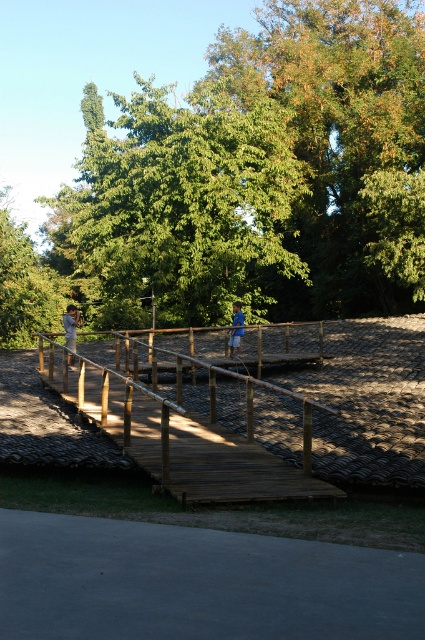
Between point (73, 308) and point (238, 310), which one is positioned behind?

The point (238, 310) is more distant.

Is blue fabric shirt at center closer to camera compared to blue cotton shirt at center?

That is True.

Who is more distant from viewer, (71, 337) or (235, 344)?

Positioned behind is point (235, 344).

What are the coordinates of `blue fabric shirt at center` in the screenshot? It's located at (70, 324).

Based on the photo, can you confirm if wooden bridge at center is positioned above blue fabric shirt at center?

Actually, wooden bridge at center is below blue fabric shirt at center.

Does point (232, 500) lie in front of point (68, 310)?

Yes, point (232, 500) is closer to viewer.

Between point (204, 435) and point (71, 314), which one is positioned in front?

Positioned in front is point (204, 435).

This screenshot has height=640, width=425. Find the location of `wooden bridge at center`. wooden bridge at center is located at coordinates (176, 440).

Does gray concrete path at lower center have a greater height compared to blue fabric shirt at center?

No, gray concrete path at lower center is not taller than blue fabric shirt at center.

Who is more distant from viewer, (308, 577) or (73, 356)?

Positioned behind is point (73, 356).

The width and height of the screenshot is (425, 640). What do you see at coordinates (197, 582) in the screenshot? I see `gray concrete path at lower center` at bounding box center [197, 582].

Where is `gray concrete path at lower center`? The height and width of the screenshot is (640, 425). gray concrete path at lower center is located at coordinates coord(197,582).